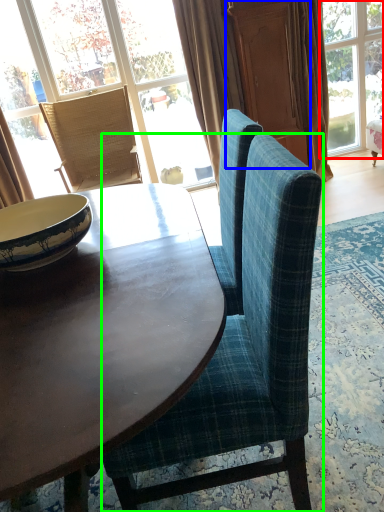
Question: Which object is positioned closest to window (highlighted by a red box)? Select from screen door (highlighted by a blue box) and chair (highlighted by a green box).

Choices:
 (A) screen door
 (B) chair

Answer: (A)